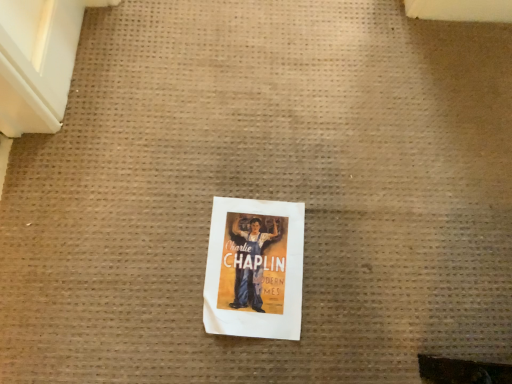
Where is `free location above matte paper poster at center (from a real-world perspective)`? Image resolution: width=512 pixels, height=384 pixels. free location above matte paper poster at center (from a real-world perspective) is located at coordinates (258, 263).